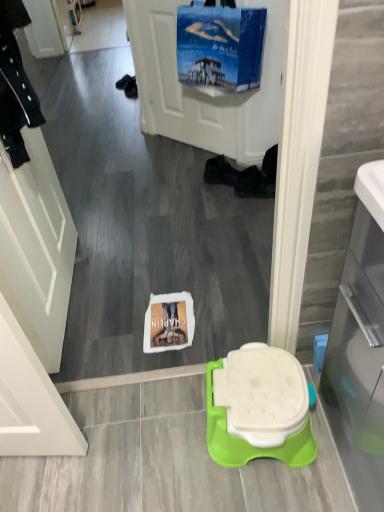
The height and width of the screenshot is (512, 384). Identify the location of free spot in front of black fabric shoe at center, which is counted as the second footwear, starting from the left. (247, 211).